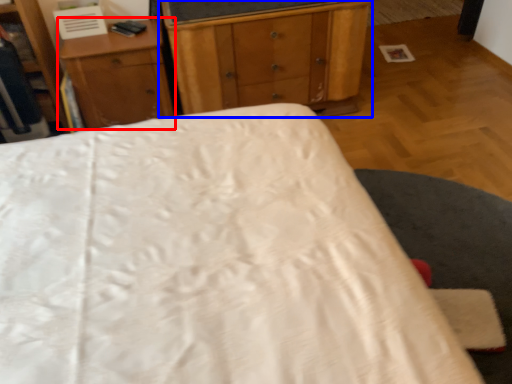
Question: Among these objects, which one is farthest to the camera, nightstand (highlighted by a red box) or chest of drawers (highlighted by a blue box)?

Choices:
 (A) nightstand
 (B) chest of drawers

Answer: (A)